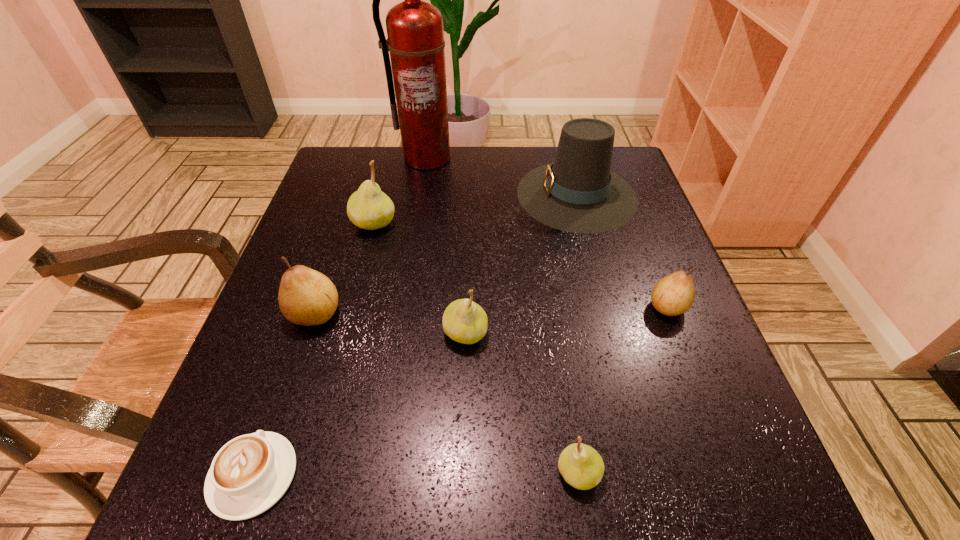
The image size is (960, 540). In order to click on hat positioned at the right edge in this screenshot , I will do `click(578, 193)`.

The width and height of the screenshot is (960, 540). Identify the location of pear situated at the right edge. (672, 295).

Identify the location of object situated at the near left corner. This screenshot has height=540, width=960. (249, 474).

The image size is (960, 540). I want to click on object present at the far right corner, so click(578, 193).

At what (x,y) coordinates should I click in order to perform the action: click on free location at the far edge of the desktop. Please return your answer as a coordinate pair (x, y). Looking at the image, I should click on (410, 181).

Where is `vacant space at the near edge of the desktop`? vacant space at the near edge of the desktop is located at coordinates (623, 481).

The height and width of the screenshot is (540, 960). Find the location of `vacant space at the left edge of the desktop`. vacant space at the left edge of the desktop is located at coordinates [x=348, y=228].

The height and width of the screenshot is (540, 960). What are the coordinates of `vacant space at the right edge of the desktop` in the screenshot? It's located at (693, 341).

Identify the location of blank space at the far left corner of the desktop. The width and height of the screenshot is (960, 540). point(353,180).

The image size is (960, 540). In order to click on vacant space at the far right corner in this screenshot , I will do [x=612, y=157].